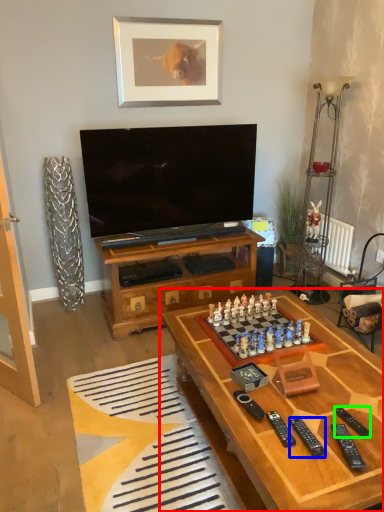
Question: Which object is positioned farthest from table (highlighted by a red box)? Select from remote (highlighted by a blue box) and remote (highlighted by a green box).

Choices:
 (A) remote
 (B) remote

Answer: (B)